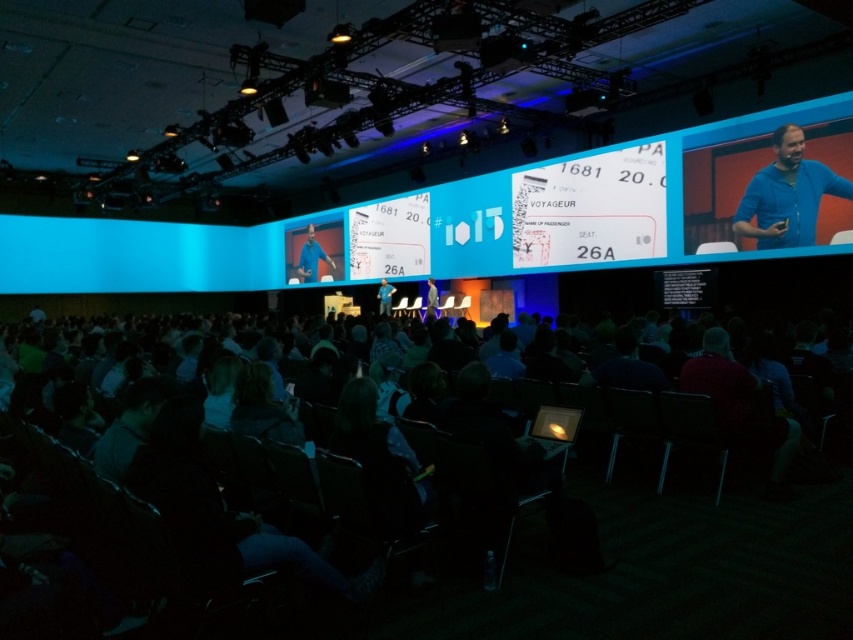
You are an attendee at the event and want to identify the presenter who is speaking from the stage. Which presenter is positioned higher on the stage between the blue cotton shirt at upper right and the light blue fabric suit at center?

The blue cotton shirt at upper right is positioned higher on the stage than the light blue fabric suit at center because it is above it.

You are attending the event and notice two people on stage wearing blue shirts. The one wearing the blue cotton shirt at upper right and the other in blue shirt at center. From your seat in the audience, which blue shirt is higher up?

The blue cotton shirt at upper right is higher up because it is positioned above the blue shirt at center.

Consider the image. You are an attendee at the event and want to know which speaker is wearing a wider garment between the blue cotton shirt at upper right and the light blue fabric suit at center. Which one should you look at?

The blue cotton shirt at upper right is wider than the light blue fabric suit at center, so you should look at the blue cotton shirt at upper right.